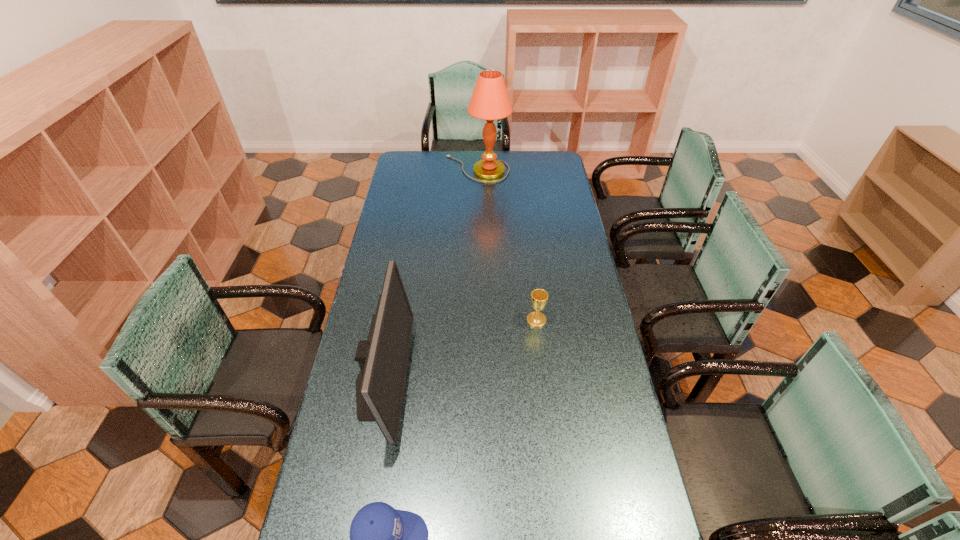
Where is `the farthest object`? the farthest object is located at coordinates (490, 101).

In order to click on the tallest object in this screenshot , I will do `click(490, 101)`.

Find the location of a particular element. Image resolution: width=960 pixels, height=540 pixels. computer monitor is located at coordinates (383, 358).

This screenshot has width=960, height=540. What are the coordinates of `the rightmost object` in the screenshot? It's located at 539,297.

You are a GUI agent. You are given a task and a screenshot of the screen. Output one action in this format:
    pyautogui.click(x=<x>, y=<y>)
    Task: Click on the third tallest object
    This screenshot has height=540, width=960.
    Given the screenshot: What is the action you would take?
    pyautogui.click(x=539, y=297)

Image resolution: width=960 pixels, height=540 pixels. What are the coordinates of `free space located 0.080m on the right of the lamp` in the screenshot? It's located at (525, 169).

Find the location of a particular element. This screenshot has width=960, height=540. vacant area situated on the screen side of the computer monitor is located at coordinates (476, 381).

Identify the location of free location located 0.140m on the left of the chalice. (488, 320).

In order to click on object that is at the far edge in this screenshot , I will do `click(490, 101)`.

Where is `object that is positioned at the left edge`? The height and width of the screenshot is (540, 960). object that is positioned at the left edge is located at coordinates (383, 358).